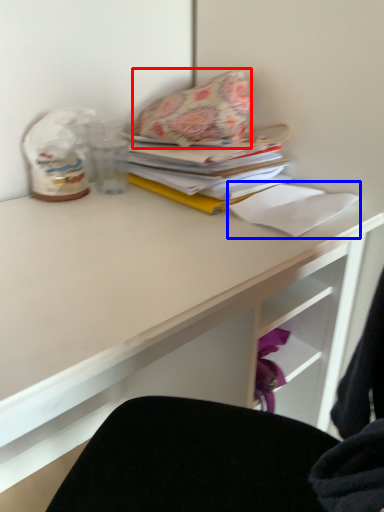
Question: Which point is closer to the camera, throw pillow (highlighted by a red box) or paper (highlighted by a blue box)?

Choices:
 (A) throw pillow
 (B) paper

Answer: (B)